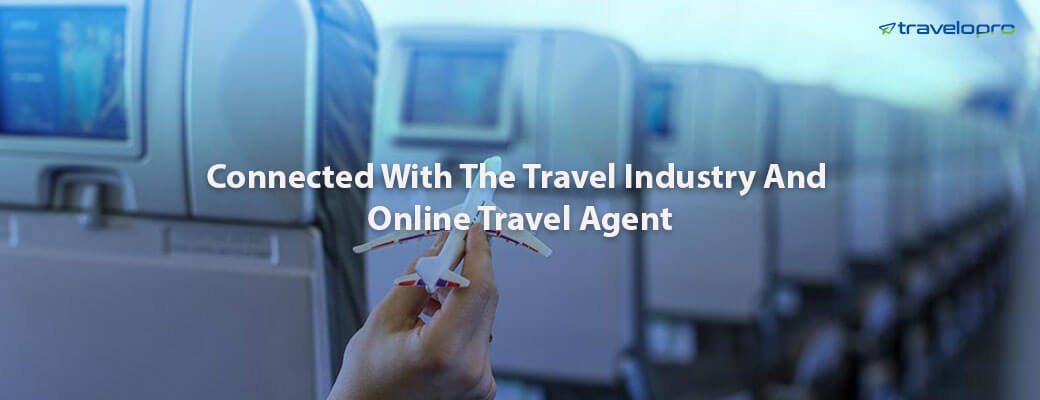
I want to click on floor, so click(x=992, y=357).